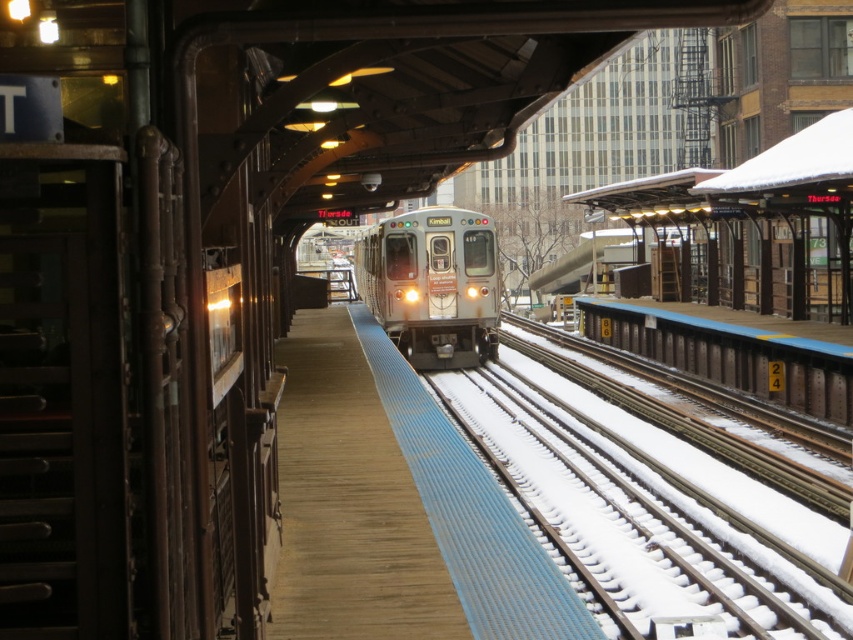
Question: Which object appears farthest from the camera in this image?

Choices:
 (A) silver metallic train at center
 (B) wooden platform at center

Answer: (A)

Question: Which object appears farthest from the camera in this image?

Choices:
 (A) wooden platform at center
 (B) silver metallic train at center

Answer: (B)

Question: Which point is closer to the camera taking this photo?

Choices:
 (A) (440, 358)
 (B) (294, 424)

Answer: (B)

Question: Is wooden platform at center below silver metallic train at center?

Choices:
 (A) yes
 (B) no

Answer: (A)

Question: Is the position of wooden platform at center more distant than that of silver metallic train at center?

Choices:
 (A) no
 (B) yes

Answer: (A)

Question: Can you confirm if wooden platform at center is positioned to the right of silver metallic train at center?

Choices:
 (A) yes
 (B) no

Answer: (A)